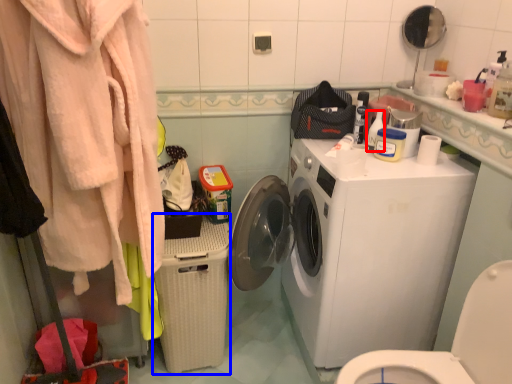
Question: Which object appears closest to the camera in this image, cleaning product (highlighted by a red box) or dish washer (highlighted by a blue box)?

Choices:
 (A) cleaning product
 (B) dish washer

Answer: (B)